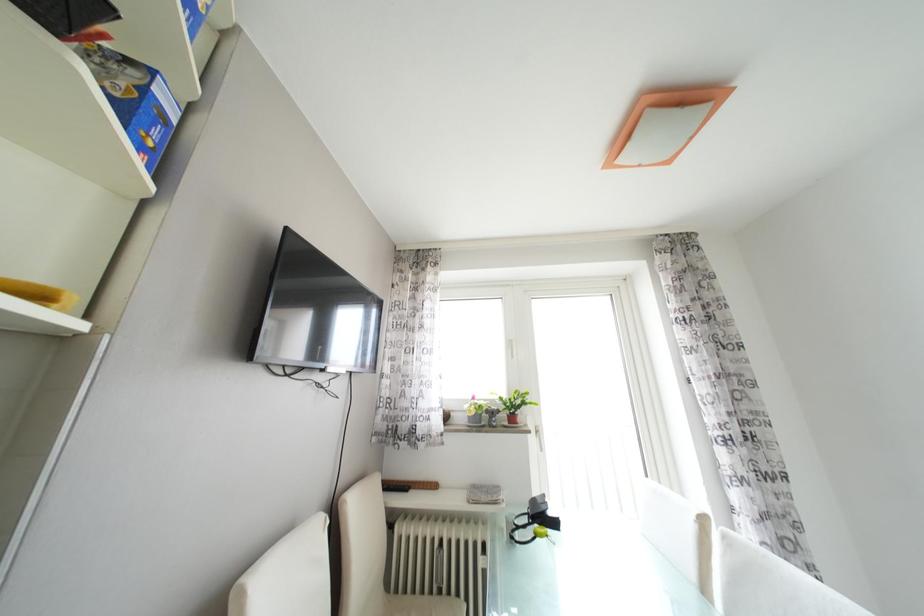
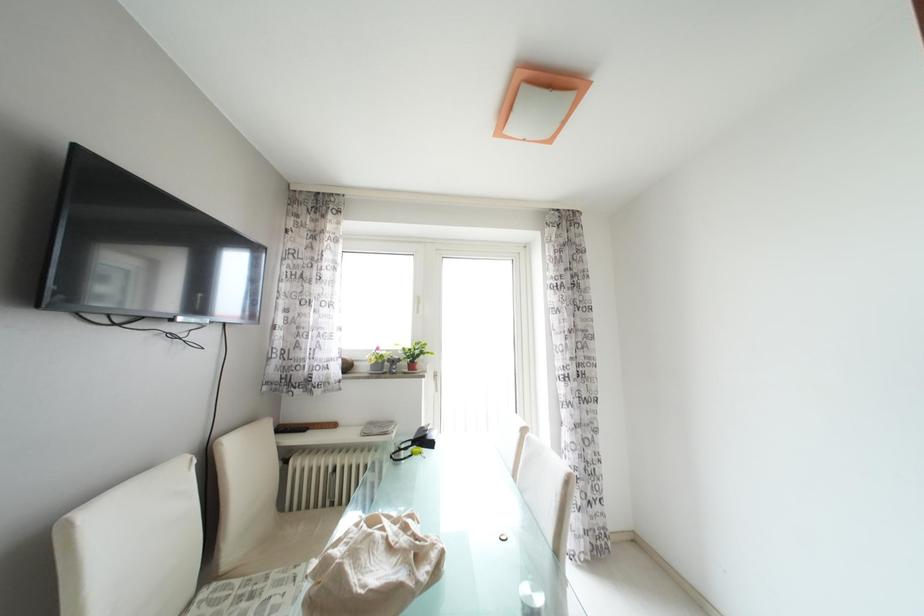
What movement of the cameraman would produce the second image?

The movement direction of the cameraman is right, backward.